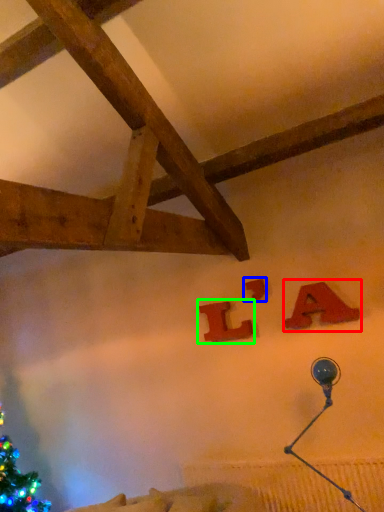
Question: Which is nearer to the alphabet (highlighted by a red box)? alphabet (highlighted by a blue box) or alphabet (highlighted by a green box).

Choices:
 (A) alphabet
 (B) alphabet

Answer: (A)